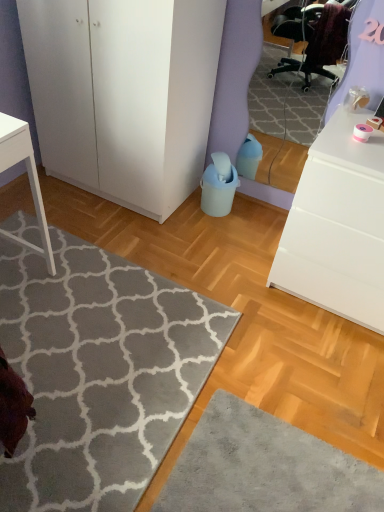
Question: Should I look upward or downward to see white matte cabinet at left?

Choices:
 (A) down
 (B) up

Answer: (B)

Question: Are gray soft rug at lower left and white matte cabinet at left beside each other?

Choices:
 (A) no
 (B) yes

Answer: (A)

Question: Is gray soft rug at lower left not within white matte cabinet at left?

Choices:
 (A) no
 (B) yes

Answer: (B)

Question: Is gray soft rug at lower left taller than white matte cabinet at left?

Choices:
 (A) yes
 (B) no

Answer: (B)

Question: Is gray soft rug at lower left in front of white matte cabinet at left?

Choices:
 (A) yes
 (B) no

Answer: (A)

Question: Is gray soft rug at lower left bigger than white matte cabinet at left?

Choices:
 (A) no
 (B) yes

Answer: (A)

Question: From the image's perspective, is gray soft rug at lower left located beneath white matte cabinet at left?

Choices:
 (A) yes
 (B) no

Answer: (A)

Question: From the image's perspective, is gray soft rug at lower left under white matte chest of drawers at right?

Choices:
 (A) yes
 (B) no

Answer: (A)

Question: Is gray soft rug at lower left next to white matte chest of drawers at right and touching it?

Choices:
 (A) yes
 (B) no

Answer: (B)

Question: Considering the relative sizes of gray soft rug at lower left and white matte chest of drawers at right in the image provided, is gray soft rug at lower left taller than white matte chest of drawers at right?

Choices:
 (A) no
 (B) yes

Answer: (A)

Question: Can you confirm if gray soft rug at lower left is smaller than white matte chest of drawers at right?

Choices:
 (A) yes
 (B) no

Answer: (A)

Question: Could white matte chest of drawers at right be considered to be inside gray soft rug at lower left?

Choices:
 (A) yes
 (B) no

Answer: (B)

Question: Is gray soft rug at lower left far from white matte chest of drawers at right?

Choices:
 (A) yes
 (B) no

Answer: (B)

Question: Is white matte chest of drawers at right looking in the opposite direction of white matte cabinet at left?

Choices:
 (A) yes
 (B) no

Answer: (B)